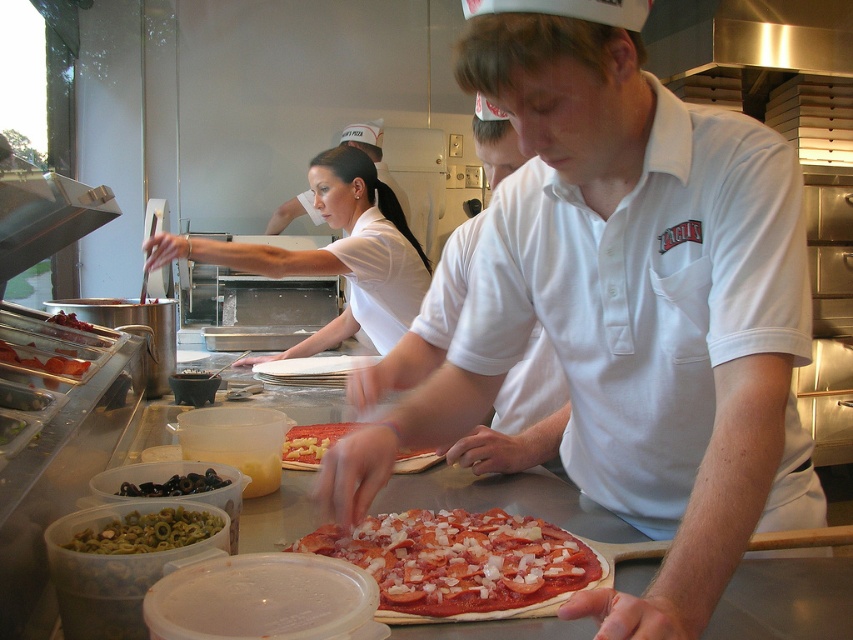
You are a customer in the pizzeria and want to see both the white smooth uniform at center and the black olives at center. Which one is higher in the image?

The white smooth uniform at center is located above the black olives at center, so it is higher in the image.

You are a customer standing at the counter and see the white smooth uniform at center and black olives at center. How far apart are these two items from each other?

The white smooth uniform at center and black olives at center are 4.62 feet apart from each other.